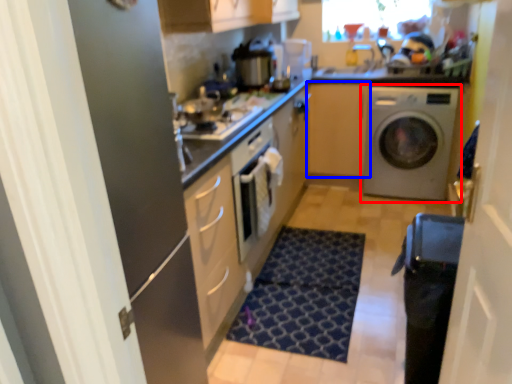
Question: Which point is further to the camera, washing machine (highlighted by a red box) or cabinetry (highlighted by a blue box)?

Choices:
 (A) washing machine
 (B) cabinetry

Answer: (B)